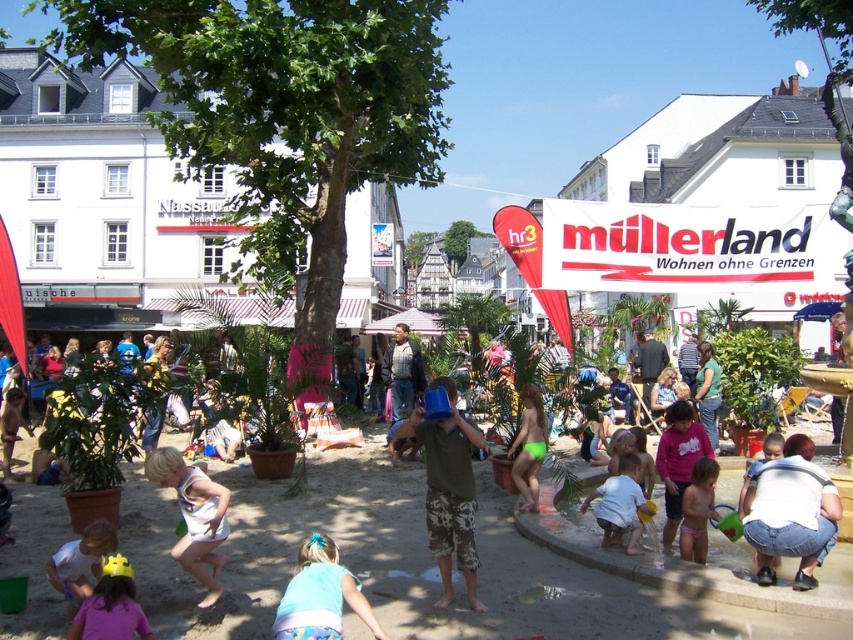
Question: Which point is farther to the camera?

Choices:
 (A) (780, 516)
 (B) (691, 545)
 (C) (473, 609)

Answer: (B)

Question: Based on their relative distances, which object is farther from the green matte swimsuit at center?

Choices:
 (A) white cotton dress at lower left
 (B) yellow plastic crown at lower left

Answer: (B)

Question: Is yellow plastic crown at lower left wider than white matte sand at center?

Choices:
 (A) no
 (B) yes

Answer: (B)

Question: Among these points, which one is farthest from the camera?

Choices:
 (A) (461, 468)
 (B) (131, 579)

Answer: (A)

Question: Is denim jeans at lower right to the left of white cotton dress at lower left from the viewer's perspective?

Choices:
 (A) no
 (B) yes

Answer: (A)

Question: Does green matte swimsuit at center have a larger size compared to pink fabric swimsuit at lower center?

Choices:
 (A) yes
 (B) no

Answer: (A)